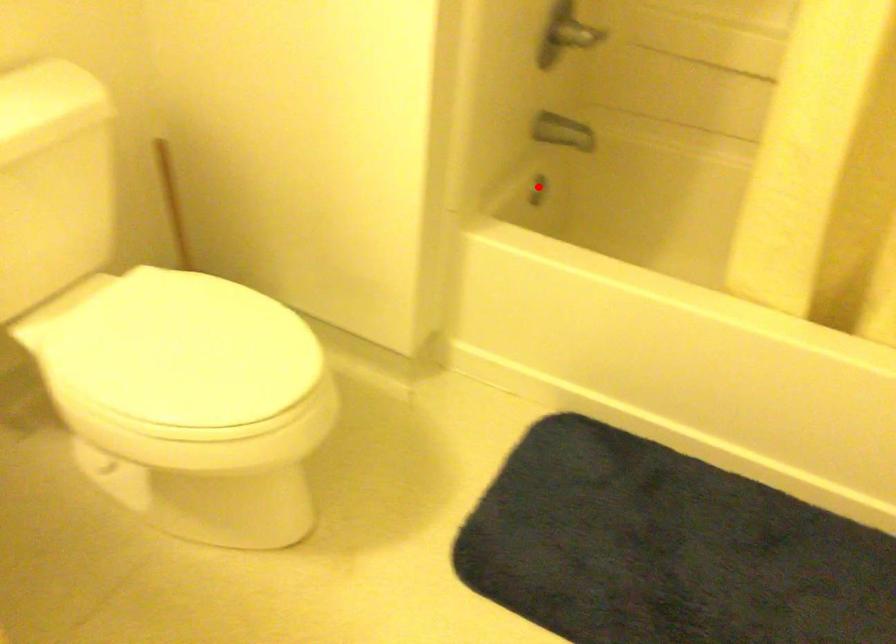
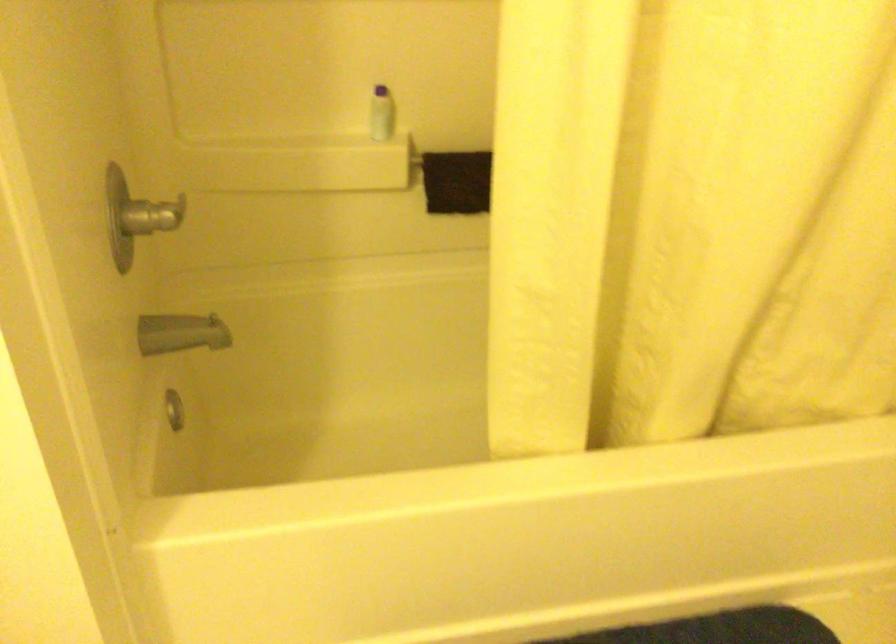
Question: I am providing you with two images of the same scene from different viewpoints. Image1 has a red point marked. In image2, the corresponding 3D location appears at what relative position? Reply with the corresponding letter.

Choices:
 (A) Closer
 (B) Farther

Answer: (A)